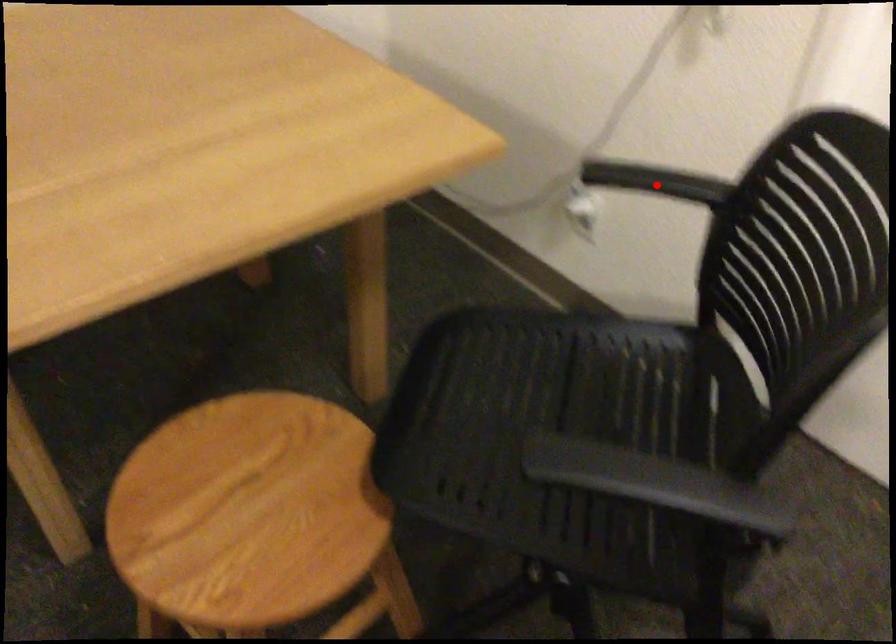
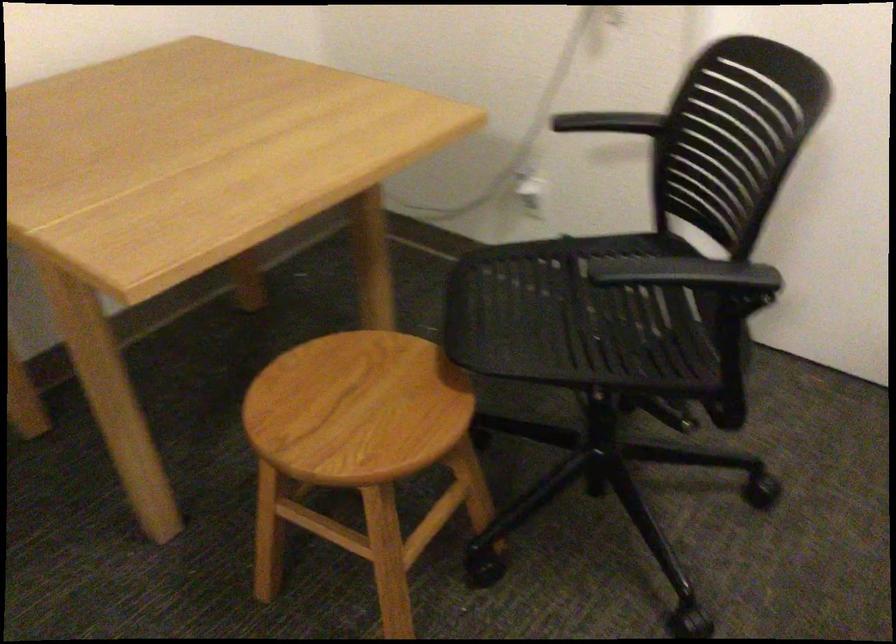
Question: I am providing you with two images of the same scene from different viewpoints. In image1, a red point is highlighted. Considering the same 3D point in image2, which of the following is correct?

Choices:
 (A) It is closer
 (B) It is farther

Answer: (B)